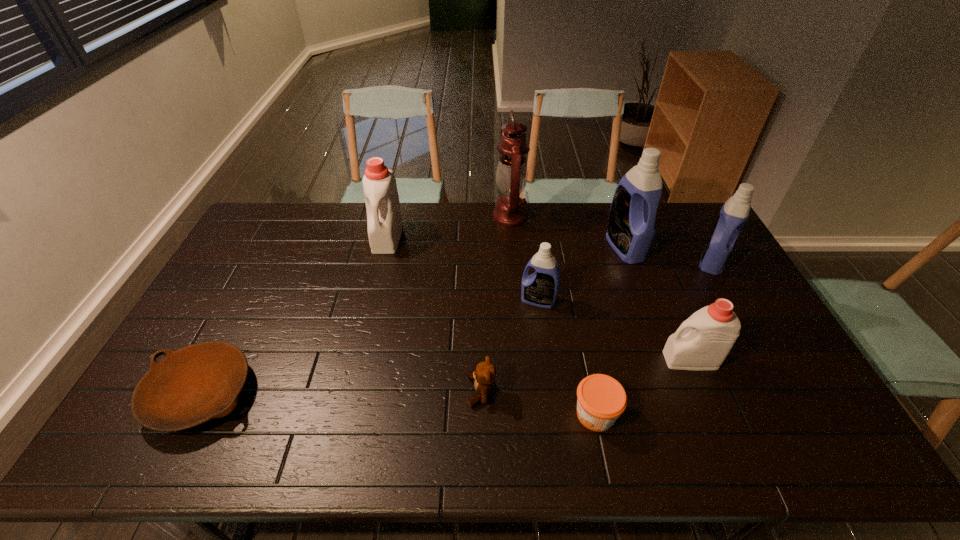
I want to click on vacant space located on the back of the brown plate, so click(237, 325).

The height and width of the screenshot is (540, 960). Identify the location of oil lamp located in the far edge section of the desktop. (511, 174).

Find the location of a particular element. This screenshot has width=960, height=540. jam that is at the near edge is located at coordinates (601, 399).

Where is `plate that is at the near edge`? Image resolution: width=960 pixels, height=540 pixels. plate that is at the near edge is located at coordinates (200, 382).

The width and height of the screenshot is (960, 540). I want to click on object present at the left edge, so click(x=200, y=382).

The image size is (960, 540). Find the location of `object at the right edge`. object at the right edge is located at coordinates (734, 213).

You are a GUI agent. You are given a task and a screenshot of the screen. Output one action in this format:
    pyautogui.click(x=<x>, y=<y>)
    Task: Click on the object situated at the near left corner
    This screenshot has height=540, width=960.
    Given the screenshot: What is the action you would take?
    pyautogui.click(x=200, y=382)

Locate an element on the screen. vacant space at the far edge of the desktop is located at coordinates (307, 205).

The width and height of the screenshot is (960, 540). I want to click on free spot at the near edge of the desktop, so click(x=553, y=447).

This screenshot has width=960, height=540. What are the coordinates of `free space at the left edge` in the screenshot? It's located at (228, 296).